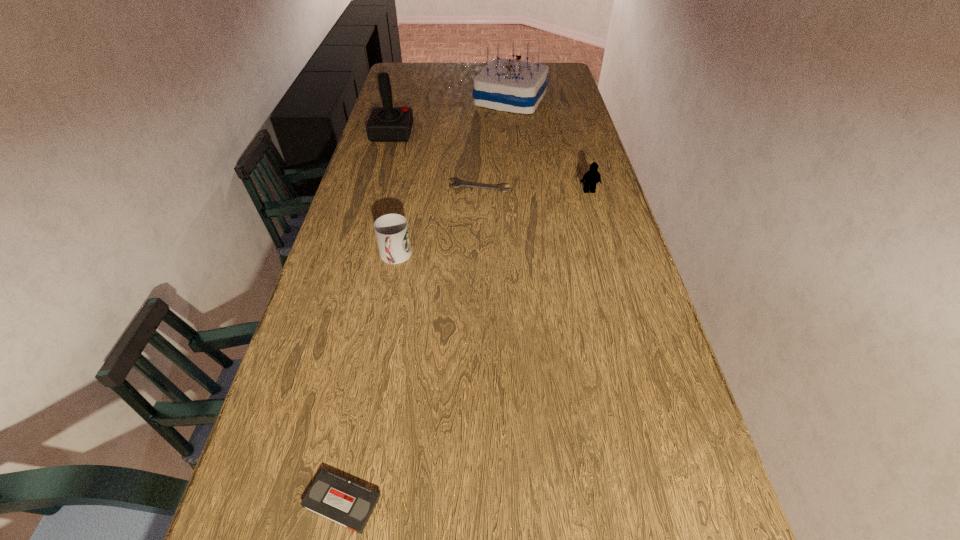
Identify the location of birthday cake. The image size is (960, 540). (508, 85).

In order to click on the fifth nearest object in this screenshot , I will do `click(385, 124)`.

The width and height of the screenshot is (960, 540). I want to click on Lego, so click(x=592, y=177).

Find the location of a particular element. The height and width of the screenshot is (540, 960). cup is located at coordinates (392, 233).

Identify the location of the second shortest object. (336, 498).

Where is `videotape`? The width and height of the screenshot is (960, 540). videotape is located at coordinates (336, 498).

What are the coordinates of `the shortest object` in the screenshot? It's located at (459, 183).

You are a GUI agent. You are given a task and a screenshot of the screen. Output one action in this format:
    pyautogui.click(x=<x>, y=<y>)
    Task: Click on the vacant space located 0.050m on the front of the birthday cake
    
    Given the screenshot: What is the action you would take?
    pyautogui.click(x=514, y=122)

Identify the location of vacant space situated on the base of the joystick. (464, 133).

The height and width of the screenshot is (540, 960). Find the location of `vacant space situated 0.130m on the face of the rightmost object`. vacant space situated 0.130m on the face of the rightmost object is located at coordinates (597, 219).